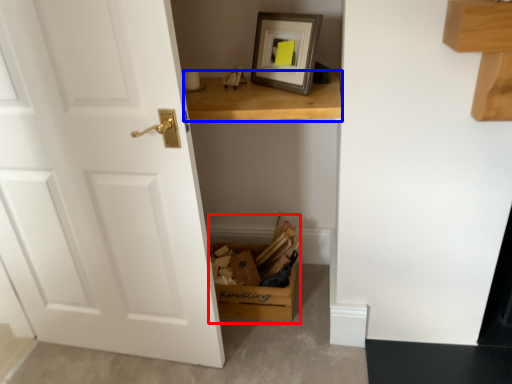
Question: Which object appears farthest to the camera in this image, cardboard box (highlighted by a red box) or table (highlighted by a blue box)?

Choices:
 (A) cardboard box
 (B) table

Answer: (A)